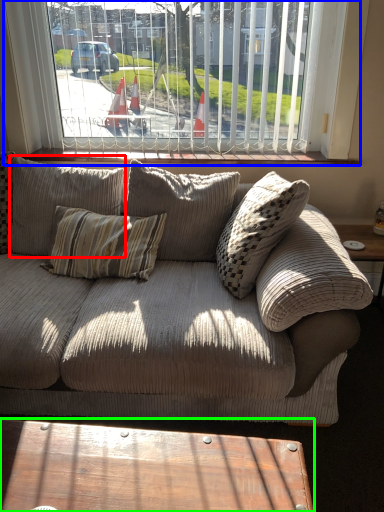
Question: Which object is the farthest from pillow (highlighted by a red box)? Choose among these: window (highlighted by a blue box) or coffee table (highlighted by a green box).

Choices:
 (A) window
 (B) coffee table

Answer: (B)